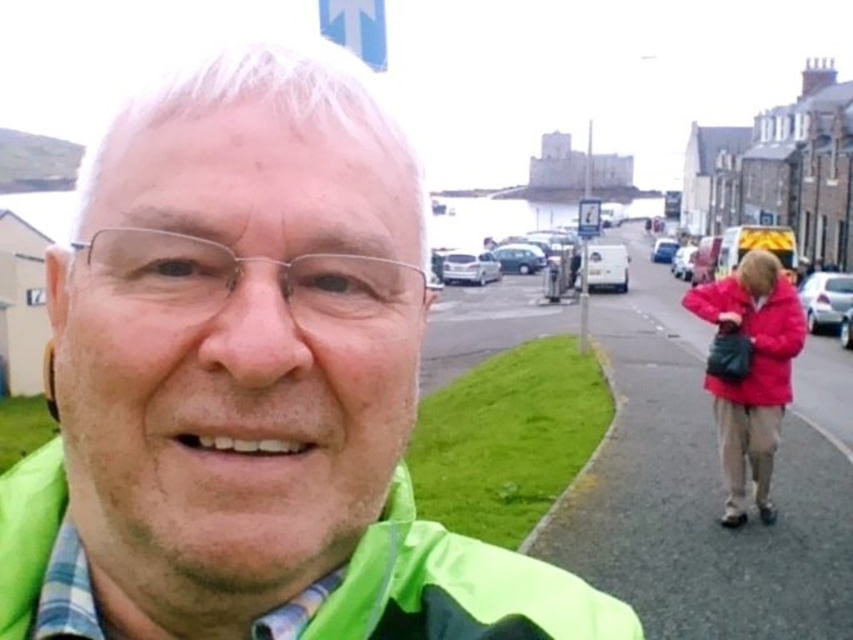
You are looking at a photo of someone wearing two green fabric jackets. The jackets are labeled as green fabric jacket at center and green fabric jacket at lower left. Which jacket is positioned more to the left side of the photo?

The green fabric jacket at center is positioned more to the left side of the photo compared to the green fabric jacket at lower left.

You are holding a camera and want to take a selfie. The camera is at point A and you want to position yourself at point B so that the distance between the camera and your face is exactly 1.02 meters. Given that point B is at coordinates point (x=158, y=458), can you confirm if positioning yourself there will achieve the desired distance?

Yes, positioning yourself at point (x=158, y=458) will achieve the desired distance of 1.02 meters between the camera and your face, as the distance between point (x=158, y=458) and the camera is exactly 1.02 meters.